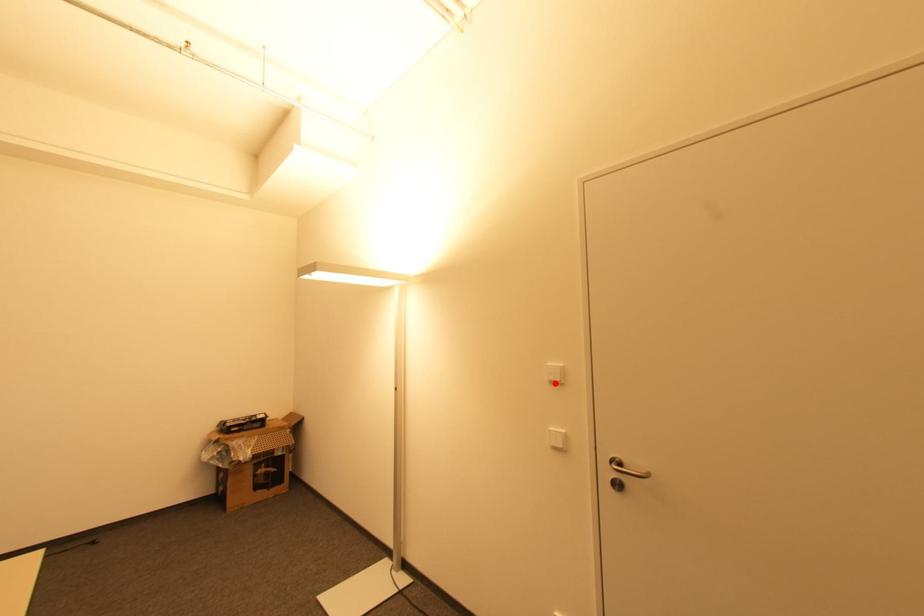
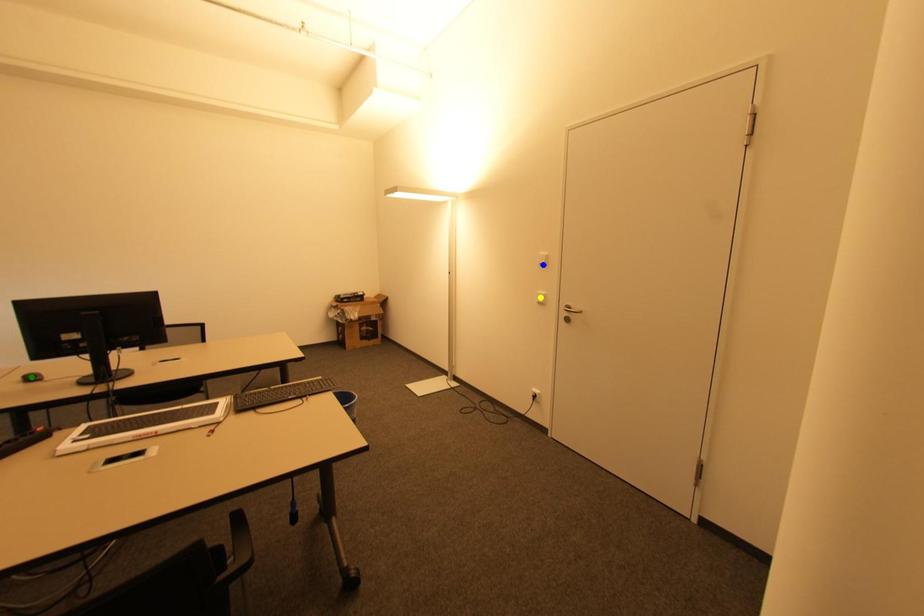
Question: I am providing you with two images of the same scene from different viewpoints. A red point is marked on the first image. You are given multiple points on the second image. In image 2, which mark is for the same physical point as the one in image 1?

Choices:
 (A) yellow point
 (B) green point
 (C) blue point

Answer: (C)